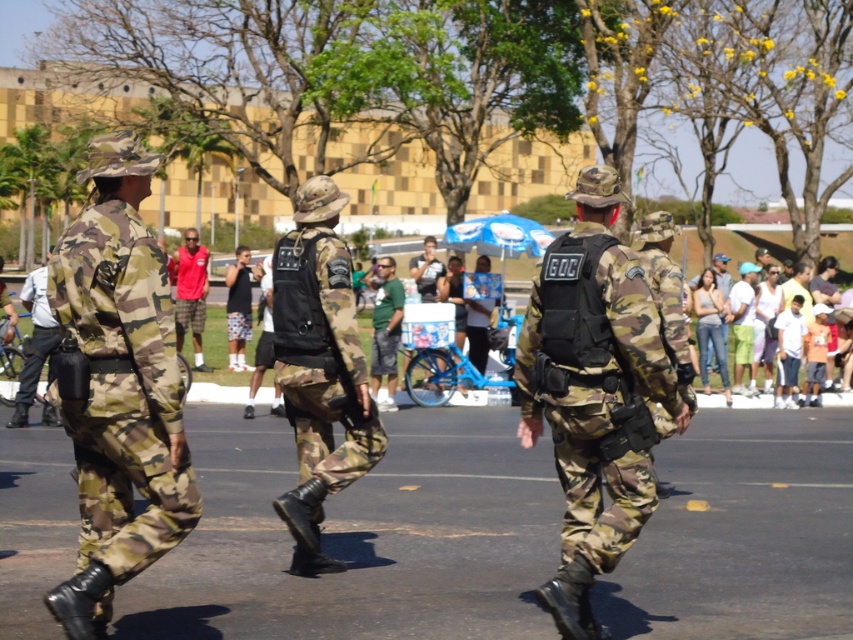
Which of these two, camouflage fabric uniform at left or black matte tank top at center, stands taller?

Standing taller between the two is camouflage fabric uniform at left.

Does camouflage fabric uniform at left have a lesser height compared to black matte tank top at center?

No, camouflage fabric uniform at left is not shorter than black matte tank top at center.

Which is in front, point (56, 612) or point (247, 308)?

Point (56, 612) is in front.

Locate an element on the screen. The image size is (853, 640). camouflage fabric uniform at left is located at coordinates (119, 387).

Does camo fabric uniform at center come behind light blue shirt at left?

That is True.

Does camo fabric uniform at center appear over light blue shirt at left?

Actually, camo fabric uniform at center is below light blue shirt at left.

What do you see at coordinates (595, 394) in the screenshot? I see `camo fabric uniform at center` at bounding box center [595, 394].

Where is `camo fabric uniform at center`? The image size is (853, 640). camo fabric uniform at center is located at coordinates (595, 394).

Is green camouflage pants at center smaller than black matte tank top at center?

Correct, green camouflage pants at center occupies less space than black matte tank top at center.

This screenshot has height=640, width=853. I want to click on green camouflage pants at center, so click(386, 326).